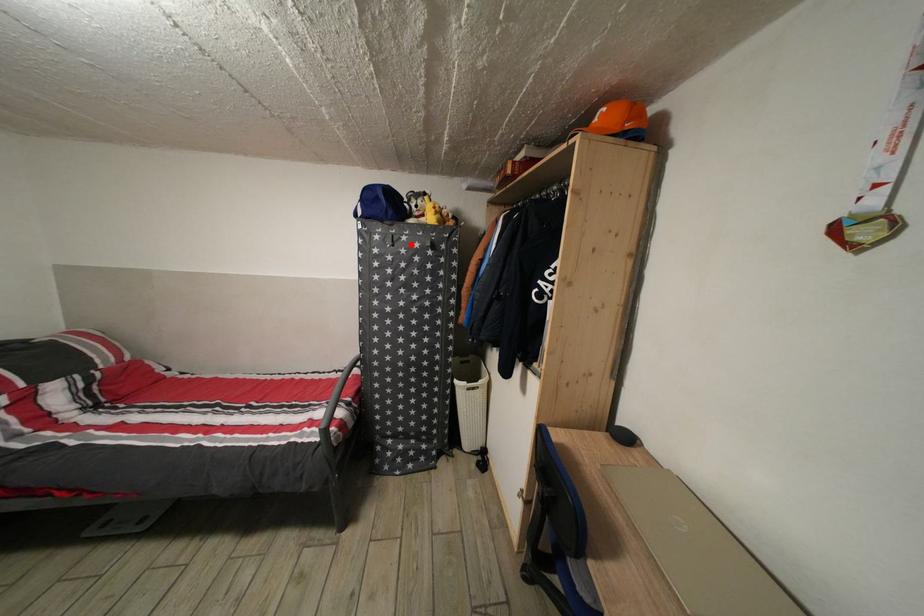
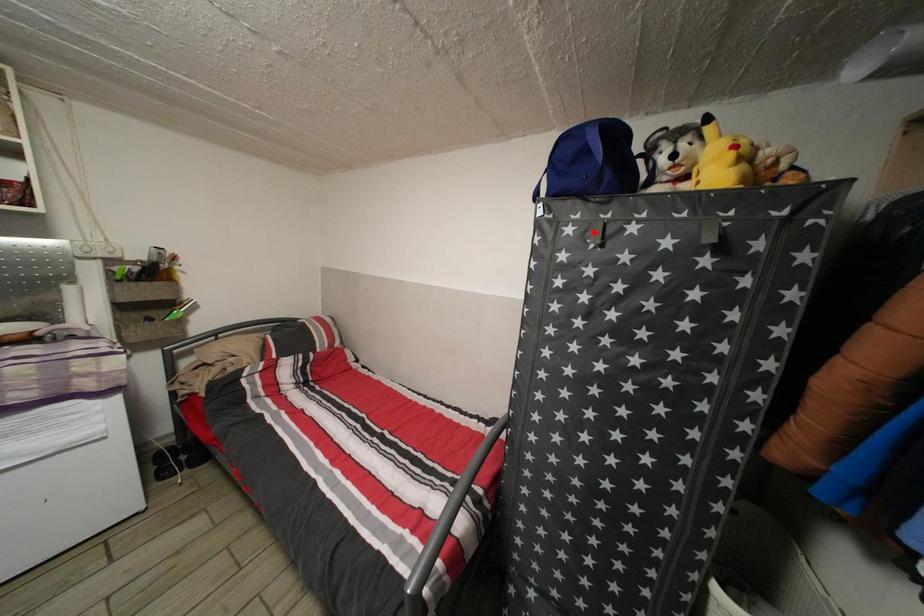
I am providing you with two images of the same scene from different viewpoints. A red point is marked on the first image and another point is marked on the second image. Is the marked point in image1 the same physical position as the marked point in image2?

No